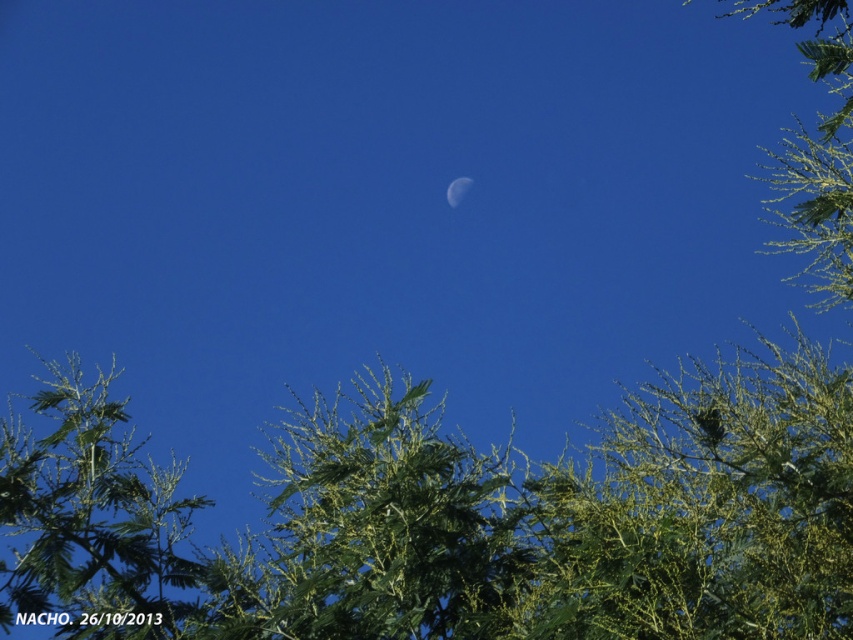
Question: Is green leafy tree at center below green leafy tree at lower left?

Choices:
 (A) no
 (B) yes

Answer: (A)

Question: Which object appears farthest from the camera in this image?

Choices:
 (A) green leafy tree at lower left
 (B) green leafy tree at center
 (C) white glossy moon at center

Answer: (C)

Question: Which of the following is the farthest from the observer?

Choices:
 (A) (454, 476)
 (B) (56, 550)

Answer: (B)

Question: Does green leafy tree at lower left have a greater width compared to white glossy moon at center?

Choices:
 (A) yes
 (B) no

Answer: (A)

Question: Which point is closer to the camera?

Choices:
 (A) green leafy tree at center
 (B) white glossy moon at center
 (C) green leafy tree at lower left

Answer: (A)

Question: Does green leafy tree at center appear on the left side of green leafy tree at lower left?

Choices:
 (A) no
 (B) yes

Answer: (A)